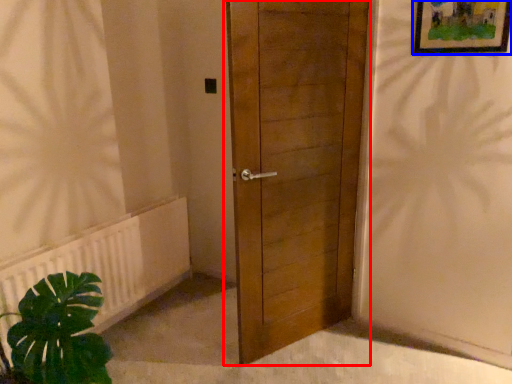
Question: Which point is further to the camera, door (highlighted by a red box) or picture frame (highlighted by a blue box)?

Choices:
 (A) door
 (B) picture frame

Answer: (B)